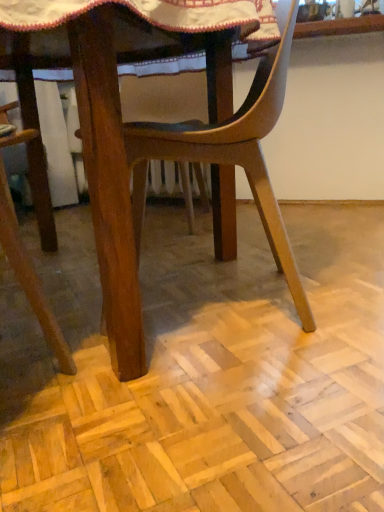
This screenshot has width=384, height=512. Find the location of `wooden chair at center`. wooden chair at center is located at coordinates (190, 161).

What do you see at coordinates (190, 161) in the screenshot?
I see `wooden chair at center` at bounding box center [190, 161].

Measure the distance between point (46, 261) and camera.

The distance of point (46, 261) from camera is 1.54 meters.

The image size is (384, 512). Describe the element at coordinates (202, 373) in the screenshot. I see `light brown wood parquet floor at center` at that location.

Find the location of a particular element. This screenshot has height=512, width=384. light brown wood parquet floor at center is located at coordinates (202, 373).

Where is `wooden chair at center`? The width and height of the screenshot is (384, 512). wooden chair at center is located at coordinates (190, 161).

Is wooden chair at center to the right of light brown wood parquet floor at center from the viewer's perspective?

No, wooden chair at center is not to the right of light brown wood parquet floor at center.

Does wooden chair at center come behind light brown wood parquet floor at center?

Yes, wooden chair at center is behind light brown wood parquet floor at center.

Is point (212, 133) closer to camera compared to point (330, 387)?

No, it is not.

Consider the image. From the image's perspective, which one is positioned higher, wooden chair at center or light brown wood parquet floor at center?

From the image's view, wooden chair at center is above.

From a real-world perspective, between wooden chair at center and light brown wood parquet floor at center, who is vertically lower?

light brown wood parquet floor at center is physically lower.

Between wooden chair at center and light brown wood parquet floor at center, which one has smaller width?

wooden chair at center is thinner.

Is wooden chair at center taller or shorter than light brown wood parquet floor at center?

In the image, wooden chair at center appears to be taller than light brown wood parquet floor at center.

Does wooden chair at center have a larger size compared to light brown wood parquet floor at center?

Indeed, wooden chair at center has a larger size compared to light brown wood parquet floor at center.

Is wooden chair at center situated inside light brown wood parquet floor at center or outside?

wooden chair at center is not inside light brown wood parquet floor at center, it's outside.

Are wooden chair at center and light brown wood parquet floor at center located far from each other?

Actually, wooden chair at center and light brown wood parquet floor at center are a little close together.

Is wooden chair at center facing towards light brown wood parquet floor at center?

No, wooden chair at center is not turned towards light brown wood parquet floor at center.

Find the location of a particular element. The height and width of the screenshot is (512, 384). plywood beneath the wooden chair at center (from a real-world perspective) is located at coordinates (202, 373).

Considering the positions of objects light brown wood parquet floor at center and wooden chair at center in the image provided, who is more to the right, light brown wood parquet floor at center or wooden chair at center?

light brown wood parquet floor at center is more to the right.

Who is more distant, light brown wood parquet floor at center or wooden chair at center?

Positioned behind is wooden chair at center.

Which is nearer, (102,389) or (250,126)?

Positioned in front is point (102,389).

From the picture: From the image's perspective, which one is positioned higher, light brown wood parquet floor at center or wooden chair at center?

wooden chair at center appears higher in the image.

From a real-world perspective, who is located lower, light brown wood parquet floor at center or wooden chair at center?

light brown wood parquet floor at center, from a real-world perspective.

Does light brown wood parquet floor at center have a lesser width compared to wooden chair at center?

Incorrect, the width of light brown wood parquet floor at center is not less than that of wooden chair at center.

Does light brown wood parquet floor at center have a lesser height compared to wooden chair at center?

Correct, light brown wood parquet floor at center is not as tall as wooden chair at center.

In terms of size, does light brown wood parquet floor at center appear bigger or smaller than wooden chair at center?

In the image, light brown wood parquet floor at center appears to be smaller than wooden chair at center.

Does light brown wood parquet floor at center contain wooden chair at center?

No, wooden chair at center is not a part of light brown wood parquet floor at center.

Is light brown wood parquet floor at center far from wooden chair at center?

No, light brown wood parquet floor at center is not far away from wooden chair at center.

Could you tell me if light brown wood parquet floor at center is facing wooden chair at center?

No, light brown wood parquet floor at center does not turn towards wooden chair at center.

From the picture: How different are the orientations of light brown wood parquet floor at center and wooden chair at center in degrees?

light brown wood parquet floor at center and wooden chair at center are facing 76.5 degrees away from each other.

Identify the location of plywood in front of the wooden chair at center. This screenshot has height=512, width=384. (202, 373).

Locate an element on the screen. plywood lying on the right of wooden chair at center is located at coordinates (202, 373).

You are a GUI agent. You are given a task and a screenshot of the screen. Output one action in this format:
    pyautogui.click(x=<x>, y=<y>)
    Task: Click on the plywood below the wooden chair at center (from a real-world perspective)
    This screenshot has width=384, height=512.
    Given the screenshot: What is the action you would take?
    pyautogui.click(x=202, y=373)